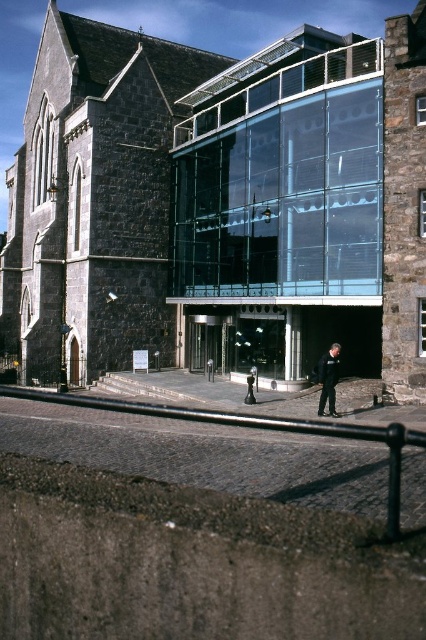
Question: Does dark stone church at center appear on the left side of black leather jacket at lower center?

Choices:
 (A) no
 (B) yes

Answer: (B)

Question: Can you confirm if dark stone church at center is positioned above black leather jacket at lower center?

Choices:
 (A) no
 (B) yes

Answer: (B)

Question: Where is dark stone church at center located in relation to black leather jacket at lower center in the image?

Choices:
 (A) below
 (B) above

Answer: (B)